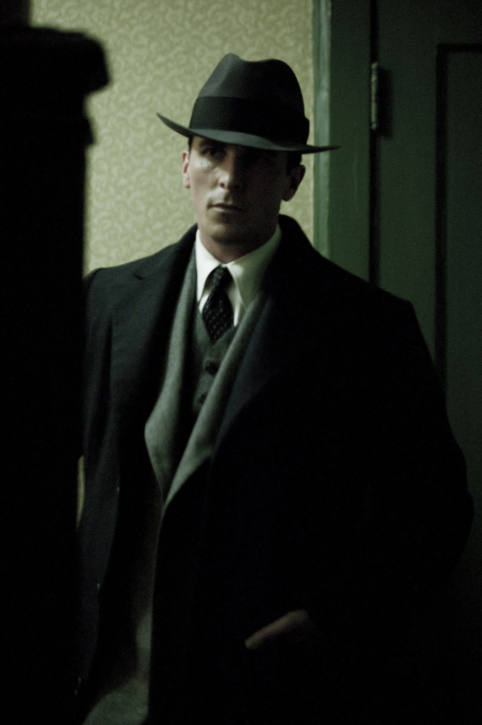
I want to click on door, so click(406, 112).